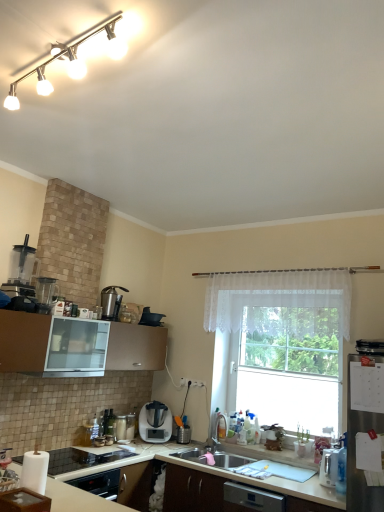
Question: From the image's perspective, is satin silver blender at center, which appears as the 1th home appliance when ordered from the bottom, positioned above or below white glossy blender at lower center, which appears as the 2th appliance when viewed from the back?

Choices:
 (A) above
 (B) below

Answer: (A)

Question: Is point (155, 411) positioned closer to the camera than point (117, 437)?

Choices:
 (A) closer
 (B) farther

Answer: (B)

Question: Which object is the closest to the metallic silver coffee maker at upper center?

Choices:
 (A) white glossy countertop at lower left, which appears as the 2th countertop when ordered from the bottom
 (B) brown matte cabinet at lower left
 (C) metallic silver toaster at lower left, the 4th appliance in the top-to-bottom sequence
 (D) white matte countertop at lower center, placed as the second countertop when sorted from top to bottom
 (E) matte black pot at upper center, marked as the 4th appliance in a bottom-to-top arrangement

Answer: (B)

Question: Estimate the real-world distances between objects in this image. Which object is closer to the satin silver kettle at lower right, the third appliance from the top?

Choices:
 (A) white matte countertop at lower center, the first countertop positioned from the bottom
 (B) clear glass window at center
 (C) metallic silver blender at left, placed as the 2th appliance when sorted from front to back
 (D) white plastic electric outlet at center
 (E) satin silver blender at center, which ranks as the second home appliance in front-to-back order

Answer: (A)